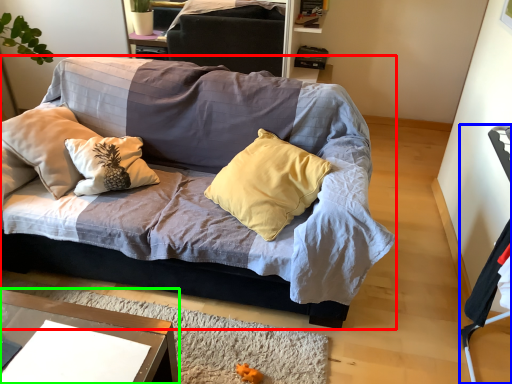
Question: Which object is the farthest from studio couch (highlighted by a red box)? Choose among these: armchair (highlighted by a blue box) or desk (highlighted by a green box).

Choices:
 (A) armchair
 (B) desk

Answer: (A)